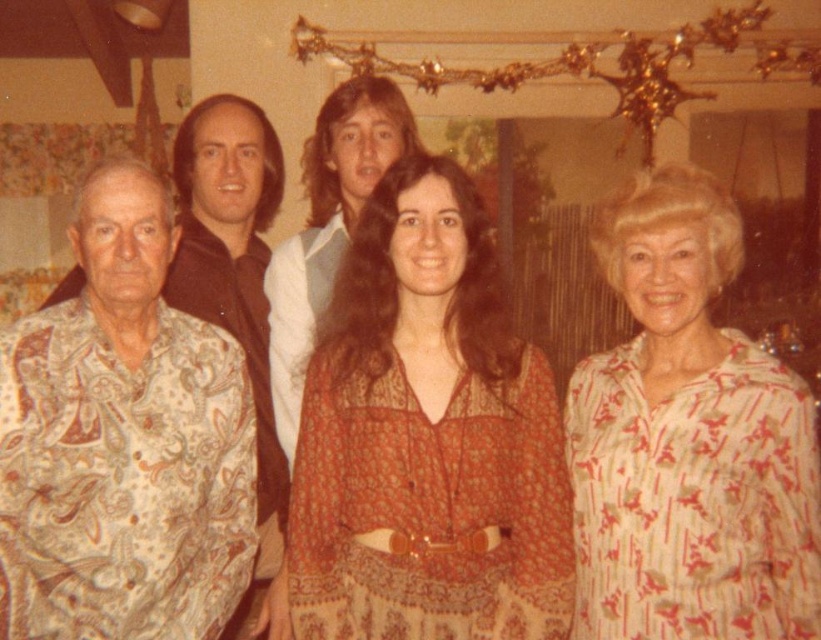
Question: Which of the following is the farthest from the observer?

Choices:
 (A) white striped dress at right
 (B) patterned fabric shirt at left
 (C) brown printed dress at center
 (D) white shirt at center

Answer: (D)

Question: Which object is closer to the camera taking this photo?

Choices:
 (A) white striped dress at right
 (B) white shirt at center

Answer: (A)

Question: Is brown printed dress at center positioned before white striped dress at right?

Choices:
 (A) no
 (B) yes

Answer: (A)

Question: Can you confirm if patterned fabric shirt at left is positioned to the left of white shirt at center?

Choices:
 (A) yes
 (B) no

Answer: (A)

Question: Can you confirm if white striped dress at right is positioned below white shirt at center?

Choices:
 (A) no
 (B) yes

Answer: (B)

Question: Among these objects, which one is nearest to the camera?

Choices:
 (A) white striped dress at right
 (B) brown printed dress at center
 (C) white shirt at center

Answer: (A)